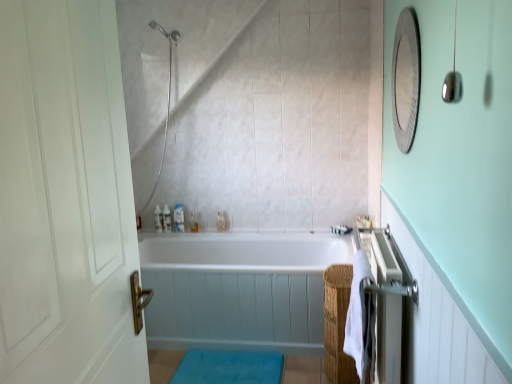
This screenshot has width=512, height=384. Identify the location of vacant space underneath blue plush bath mat at lower center (from a real-world perspective). (231, 367).